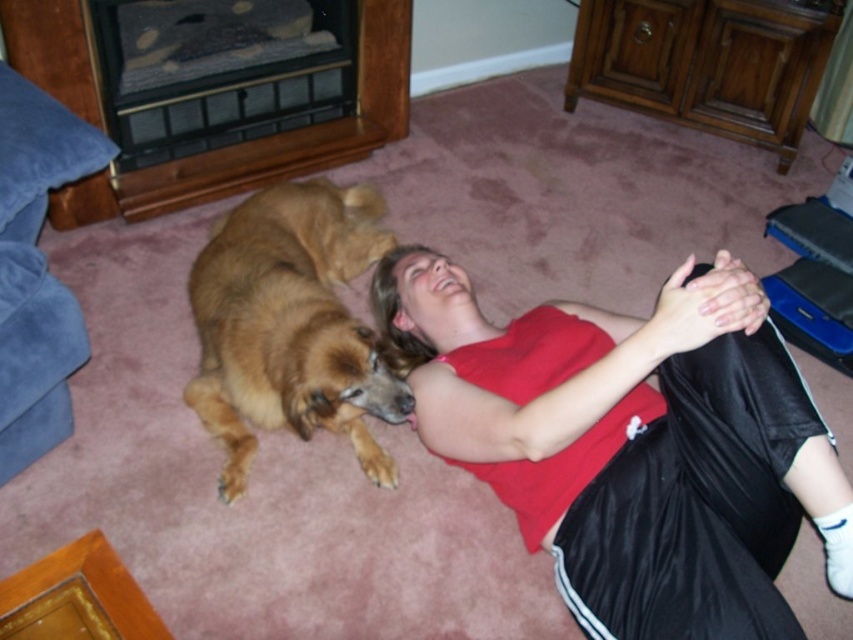
You are standing in the living room and want to place a small decorative item on one of the two points marked in the image. Which point, point 1 at coordinates (781, 356) or point 2 at coordinates (374, 416), would be closer to you if you want the item to be more visible from where you are standing?

Point 1 at coordinates (781, 356) is closer to the camera, so placing the decorative item there would make it more visible from your current position in the living room.

You are a photographer trying to capture a candid shot of the matte red tank top at center and the golden fur dog at center. Since you want to ensure both subjects are in focus, you need to know their heights. Which one is shorter?

The matte red tank top at center is shorter than the golden fur dog at center.